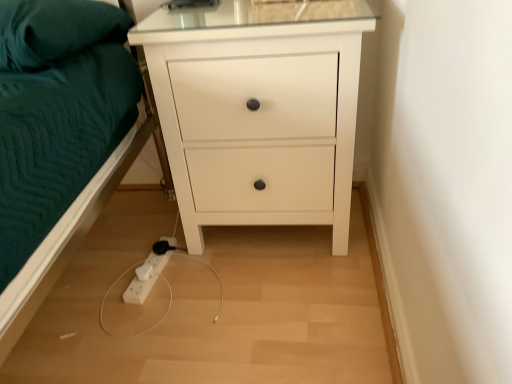
Question: Should I look upward or downward to see teal fabric pillow at upper left?

Choices:
 (A) up
 (B) down

Answer: (A)

Question: Can you confirm if teal fabric pillow at upper left is shorter than white matte chest of drawers at center?

Choices:
 (A) no
 (B) yes

Answer: (B)

Question: Is teal fabric pillow at upper left to the right of white matte chest of drawers at center from the viewer's perspective?

Choices:
 (A) yes
 (B) no

Answer: (B)

Question: From the image's perspective, is teal fabric pillow at upper left below white matte chest of drawers at center?

Choices:
 (A) no
 (B) yes

Answer: (A)

Question: Considering the relative sizes of teal fabric pillow at upper left and white matte chest of drawers at center in the image provided, is teal fabric pillow at upper left bigger than white matte chest of drawers at center?

Choices:
 (A) yes
 (B) no

Answer: (B)

Question: Does teal fabric pillow at upper left have a lesser width compared to white matte chest of drawers at center?

Choices:
 (A) yes
 (B) no

Answer: (B)

Question: Would you say white matte chest of drawers at center is part of teal fabric pillow at upper left's contents?

Choices:
 (A) no
 (B) yes

Answer: (A)

Question: From a real-world perspective, is white matte chest of drawers at center under teal fabric pillow at upper left?

Choices:
 (A) yes
 (B) no

Answer: (A)

Question: Is white matte chest of drawers at center positioned in front of teal fabric pillow at upper left?

Choices:
 (A) no
 (B) yes

Answer: (A)

Question: From the image's perspective, is white matte chest of drawers at center under teal fabric pillow at upper left?

Choices:
 (A) yes
 (B) no

Answer: (A)

Question: Are white matte chest of drawers at center and teal fabric pillow at upper left making contact?

Choices:
 (A) no
 (B) yes

Answer: (A)

Question: Is white matte chest of drawers at center positioned with its back to teal fabric pillow at upper left?

Choices:
 (A) yes
 (B) no

Answer: (B)

Question: Would you consider white matte chest of drawers at center to be distant from teal fabric pillow at upper left?

Choices:
 (A) no
 (B) yes

Answer: (A)

Question: From a real-world perspective, is white matte chest of drawers at center positioned above or below teal fabric pillow at upper left?

Choices:
 (A) below
 (B) above

Answer: (A)